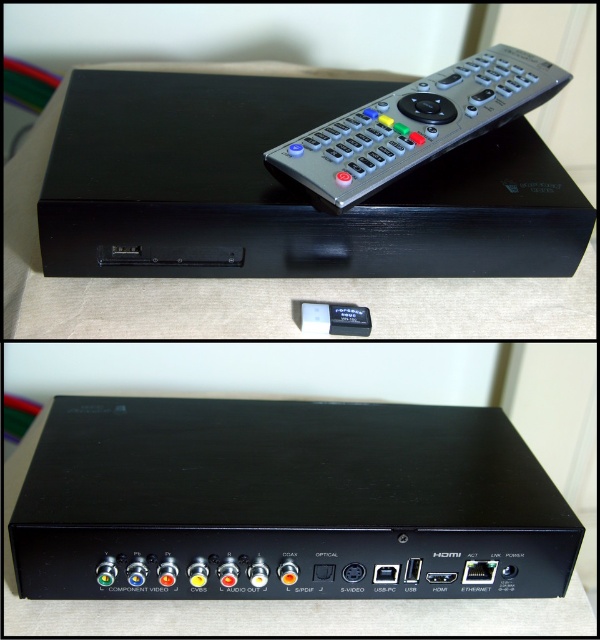
Question: Is black plastic device at center bigger than silver metallic remote at upper center?

Choices:
 (A) yes
 (B) no

Answer: (A)

Question: Which is nearer to the black matte/black plastic table at upper center?

Choices:
 (A) black plastic device at center
 (B) silver metallic remote at upper center

Answer: (B)

Question: In this image, where is black plastic device at center located relative to silver metallic remote at upper center?

Choices:
 (A) below
 (B) above

Answer: (A)

Question: Which point appears farthest from the camera in this image?

Choices:
 (A) (435, 72)
 (B) (25, 326)

Answer: (A)

Question: Among these objects, which one is farthest from the camera?

Choices:
 (A) black plastic device at center
 (B) black matte/black plastic table at upper center
 (C) silver metallic remote at upper center

Answer: (B)

Question: Observing the image, what is the correct spatial positioning of black matte/black plastic table at upper center in reference to silver metallic remote at upper center?

Choices:
 (A) left
 (B) right

Answer: (A)